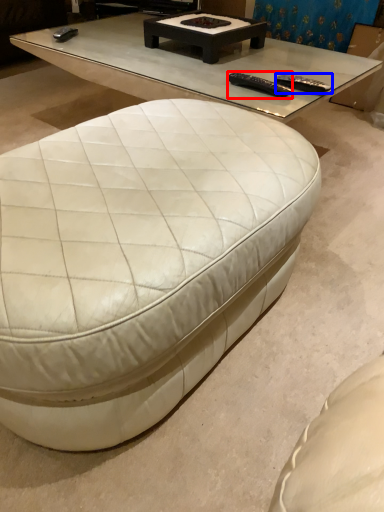
Question: Which object appears closest to the camera in this image, remote (highlighted by a red box) or remote (highlighted by a blue box)?

Choices:
 (A) remote
 (B) remote

Answer: (A)